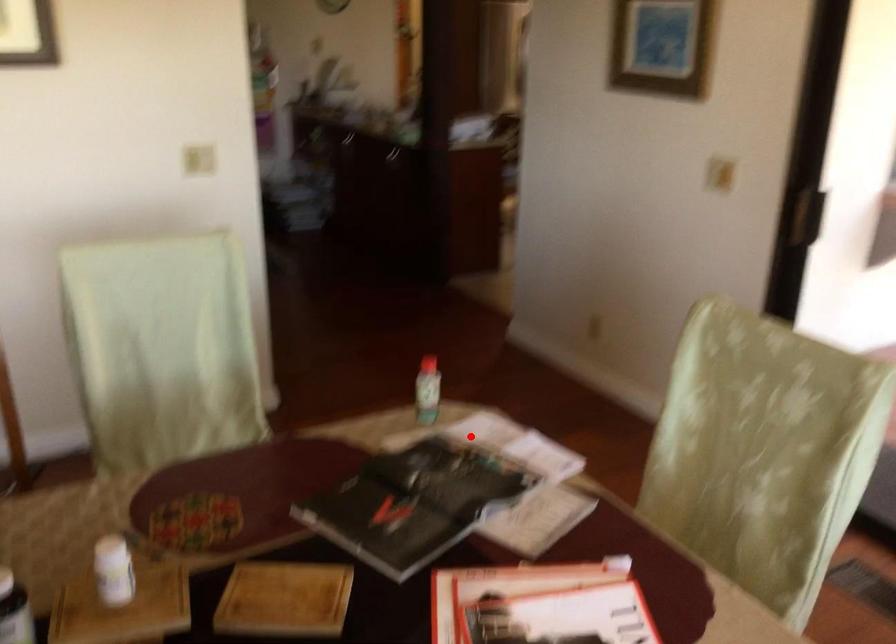
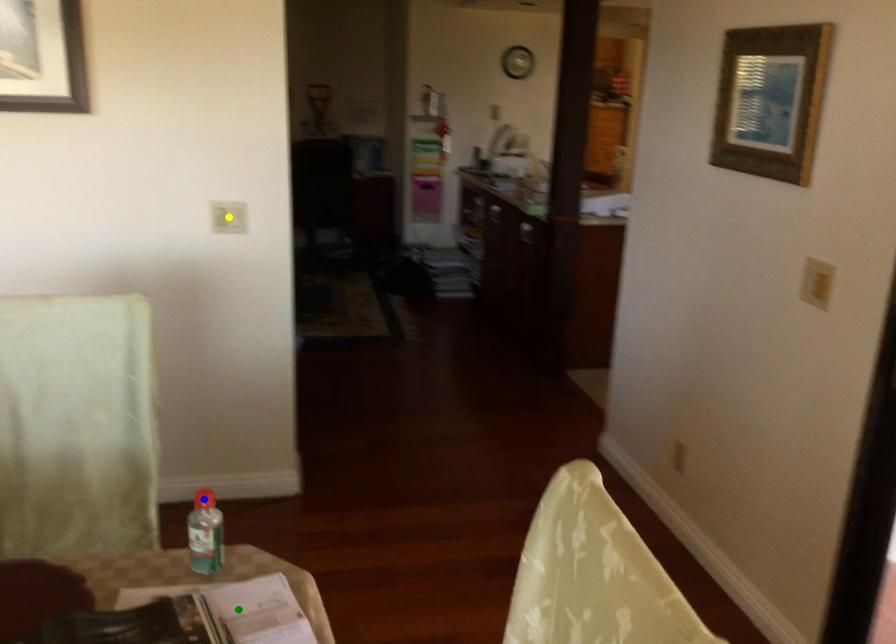
Question: I am providing you with two images of the same scene from different viewpoints. A red point is marked on the first image. You are given multiple points on the second image. Can you choose the point in image 2 that corresponds to the point in image 1?

Choices:
 (A) green point
 (B) yellow point
 (C) blue point

Answer: (A)